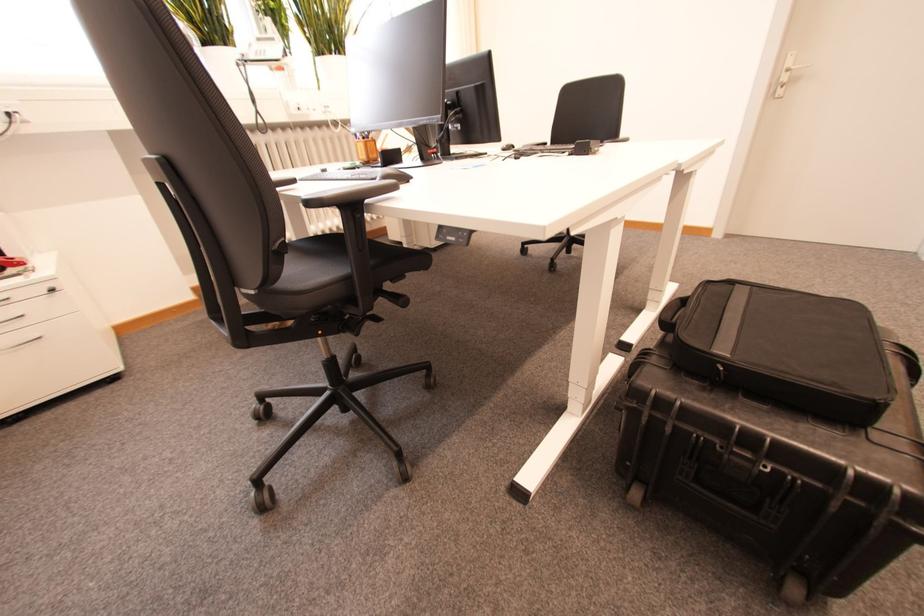
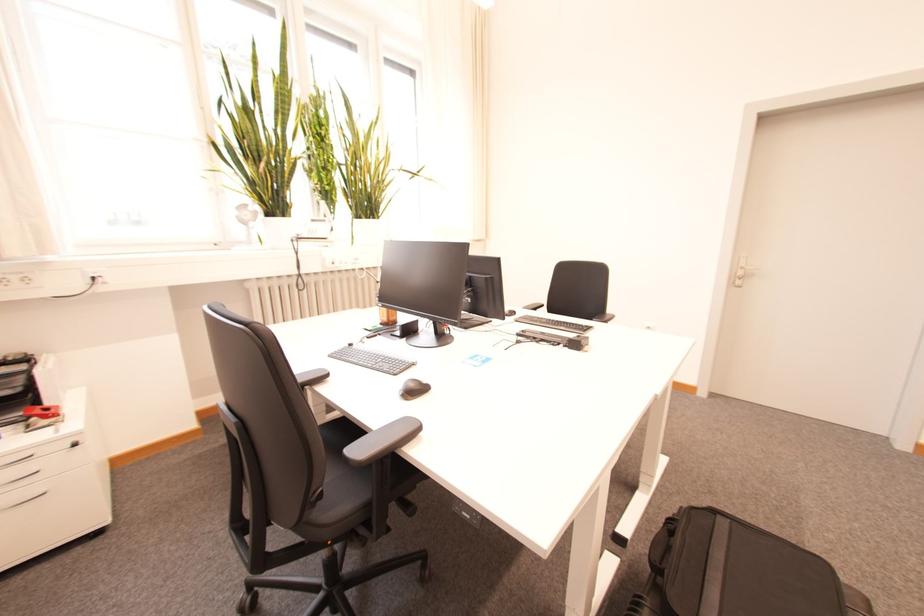
Question: Based on the continuous images, in which direction is the camera rotating? Reply with the corresponding letter.

Choices:
 (A) Left
 (B) Right
 (C) Up
 (D) Down

Answer: (C)